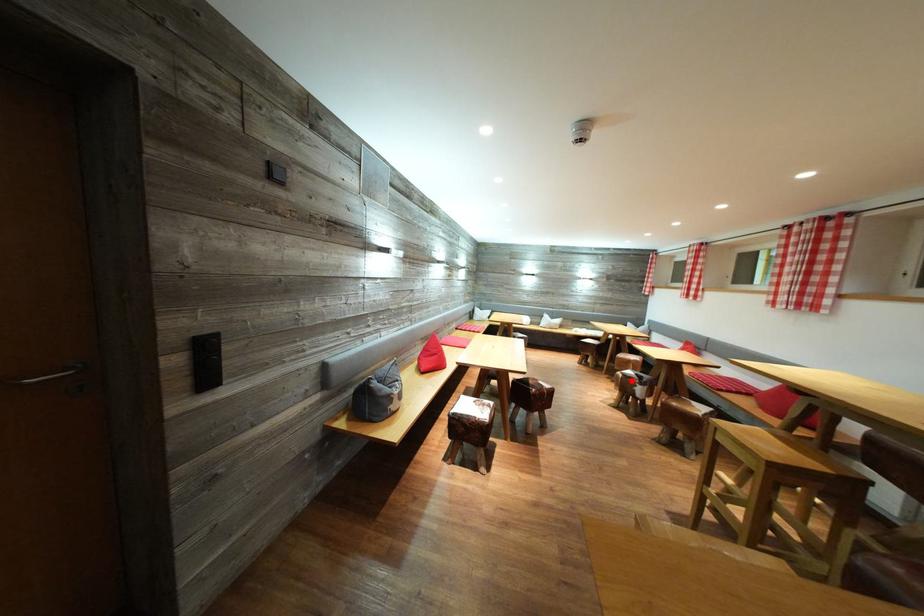
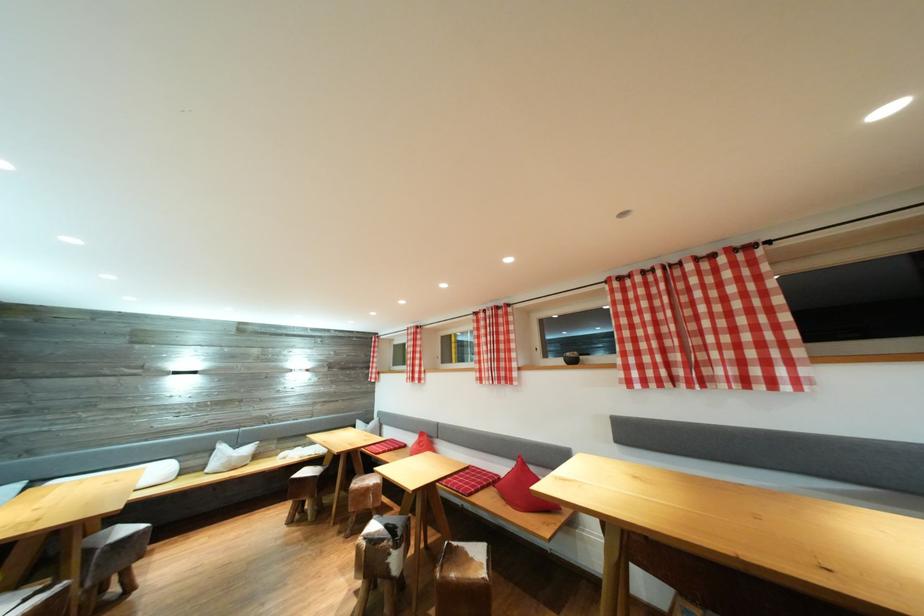
Find the pixel in the second image that matches the highlighted location in the first image.

(377, 546)